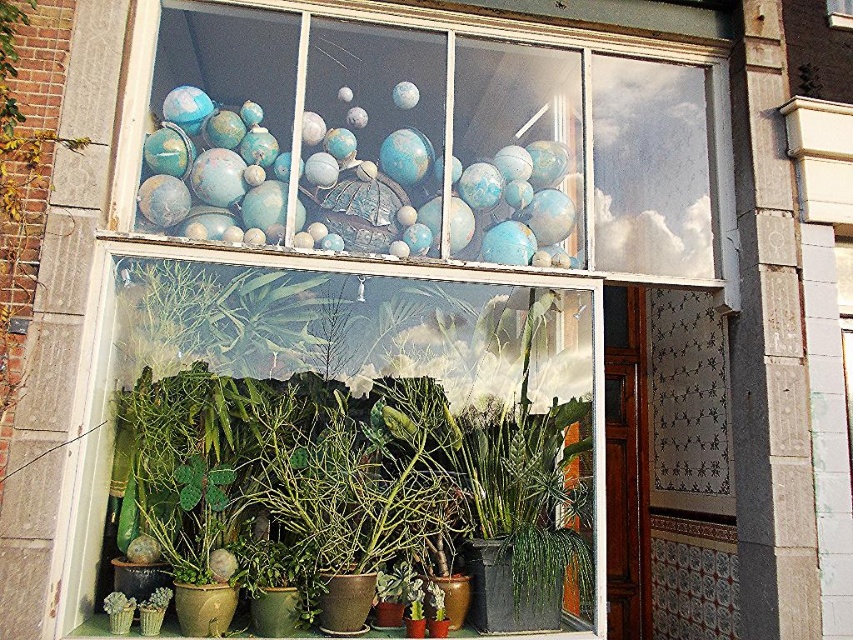
Question: Which point is farther to the camera?

Choices:
 (A) (630, 234)
 (B) (355, 529)

Answer: (A)

Question: Does green matte plant at center have a greater width compared to blue matte globes at upper center?

Choices:
 (A) no
 (B) yes

Answer: (A)

Question: Does green matte plant at center appear on the right side of blue matte globes at upper center?

Choices:
 (A) yes
 (B) no

Answer: (B)

Question: Is green matte plant at center positioned in front of blue matte globes at upper center?

Choices:
 (A) no
 (B) yes

Answer: (B)